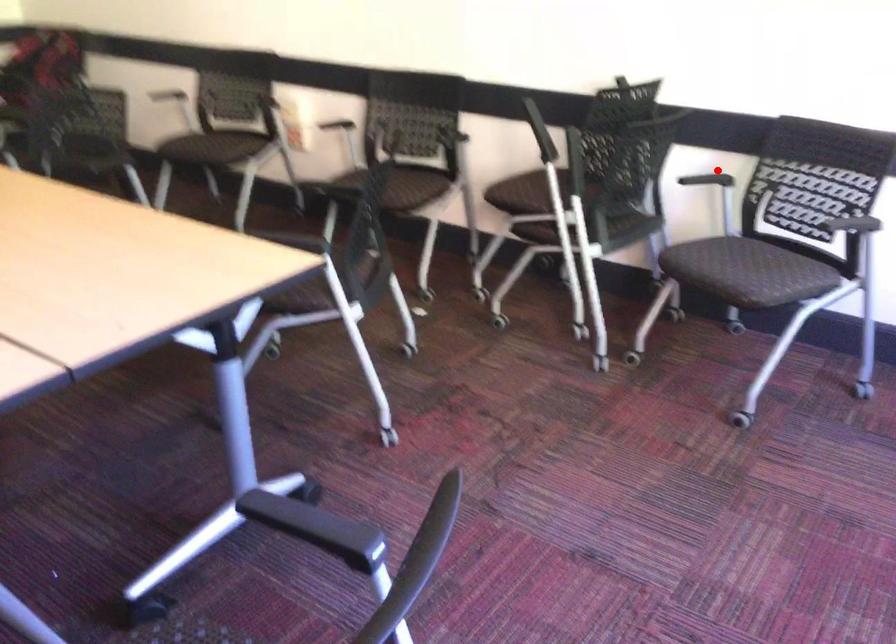
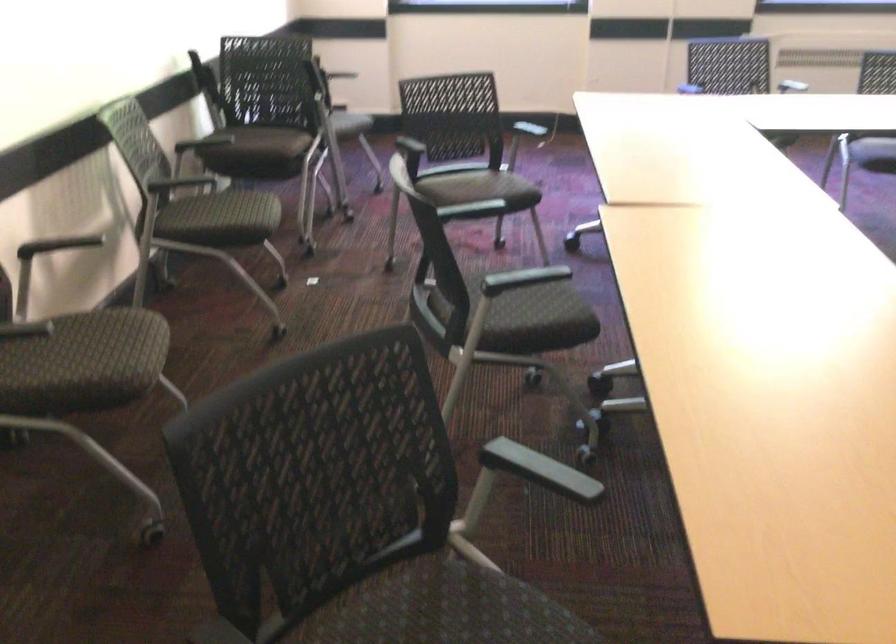
Question: I am providing you with two images of the same scene from different viewpoints. A red point is marked on the first image. At the location where the point appears in image 1, is it still visible in image 2?

Choices:
 (A) Yes
 (B) No

Answer: (B)